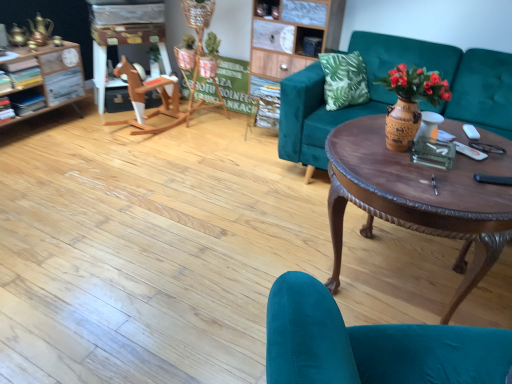
Identify the location of vacant space situated on the left part of brown polished wood coffee table at center. Image resolution: width=512 pixels, height=384 pixels. (210, 282).